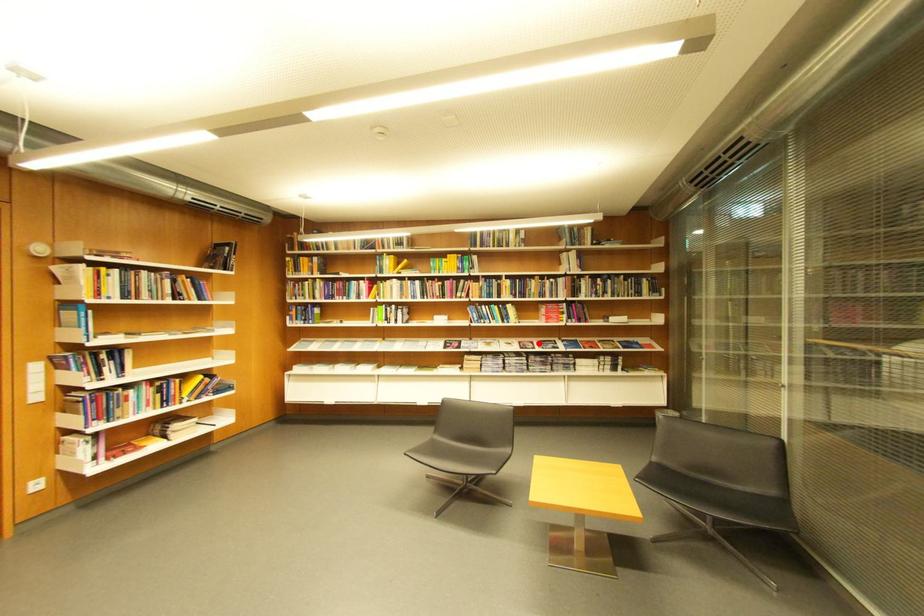
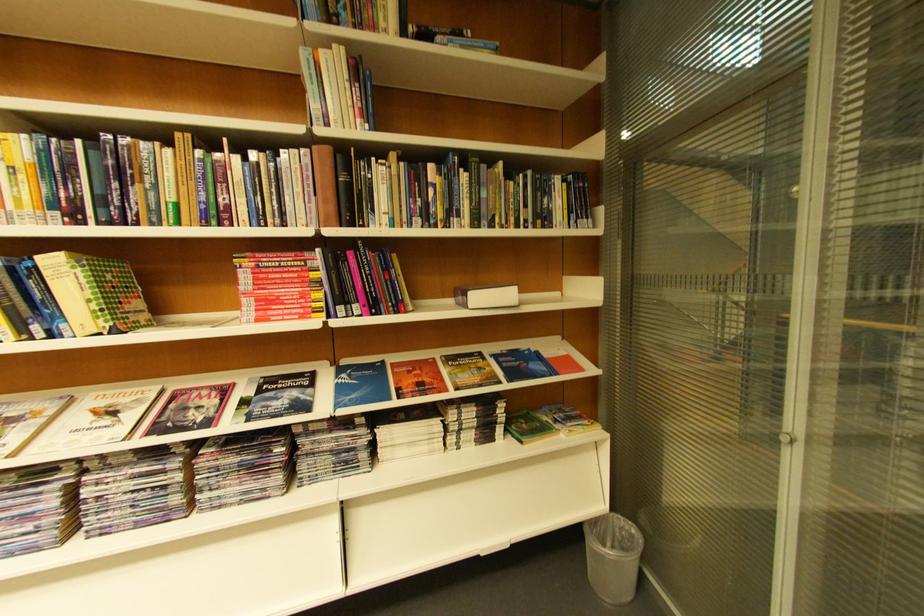
In the second image, find the point that corresponds to the highlighted location in the first image.

(224, 389)